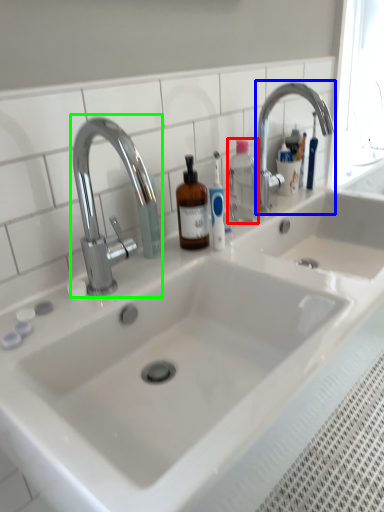
Question: Considering the real-world distances, which object is farthest from bottle (highlighted by a red box)? tap (highlighted by a blue box) or tap (highlighted by a green box)?

Choices:
 (A) tap
 (B) tap

Answer: (B)